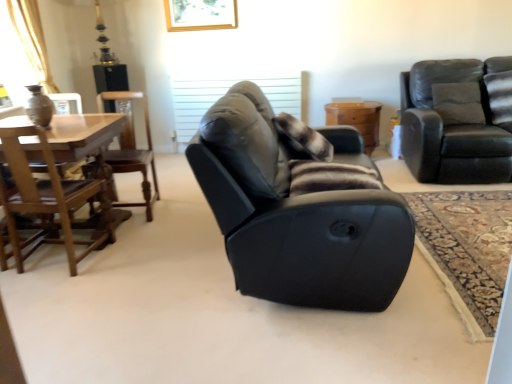
I want to click on free space on the front side of black leather recliner at center, the 3th chair in the left-to-right sequence, so click(x=300, y=342).